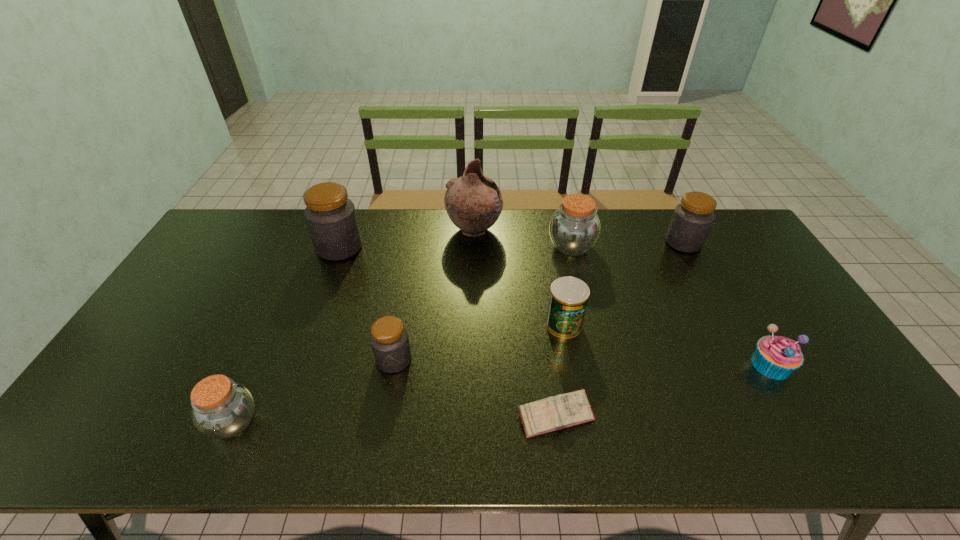
Identify the location of vacant area located 0.260m on the surface of the rightmost gray jar near the warning symbol. (590, 242).

The image size is (960, 540). What are the coordinates of `free location located on the front of the right brown jar` in the screenshot? It's located at (597, 352).

Where is `free space located 0.180m on the back of the can`? The height and width of the screenshot is (540, 960). free space located 0.180m on the back of the can is located at coordinates (554, 271).

The width and height of the screenshot is (960, 540). I want to click on vacant space situated on the surface of the nearest gray jar near the warning symbol, so click(384, 417).

Locate an element on the screen. The image size is (960, 540). vacant space located 0.110m on the right of the nearer brown jar is located at coordinates (306, 422).

The image size is (960, 540). I want to click on vacant space located 0.260m on the left of the blue muffin, so click(651, 365).

Where is `vacant space located on the left of the pink diary`? The image size is (960, 540). vacant space located on the left of the pink diary is located at coordinates (424, 416).

This screenshot has width=960, height=540. What are the coordinates of `pottery present at the far edge` in the screenshot? It's located at (473, 202).

At what (x,y) coordinates should I click in order to perform the action: click on jar that is at the near edge. Please return your answer as a coordinate pair (x, y). The height and width of the screenshot is (540, 960). Looking at the image, I should click on (222, 408).

Identify the location of diary present at the near edge. Image resolution: width=960 pixels, height=540 pixels. (569, 409).